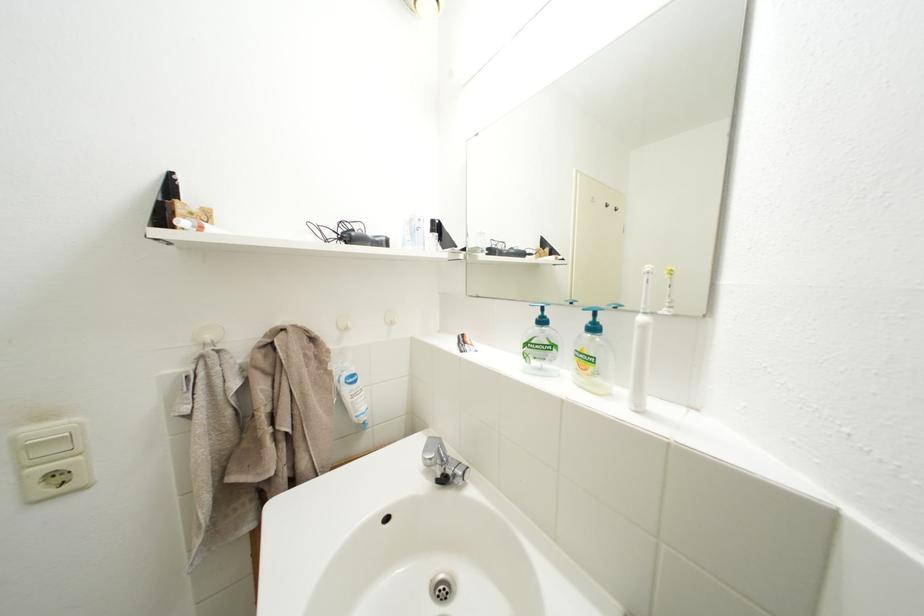
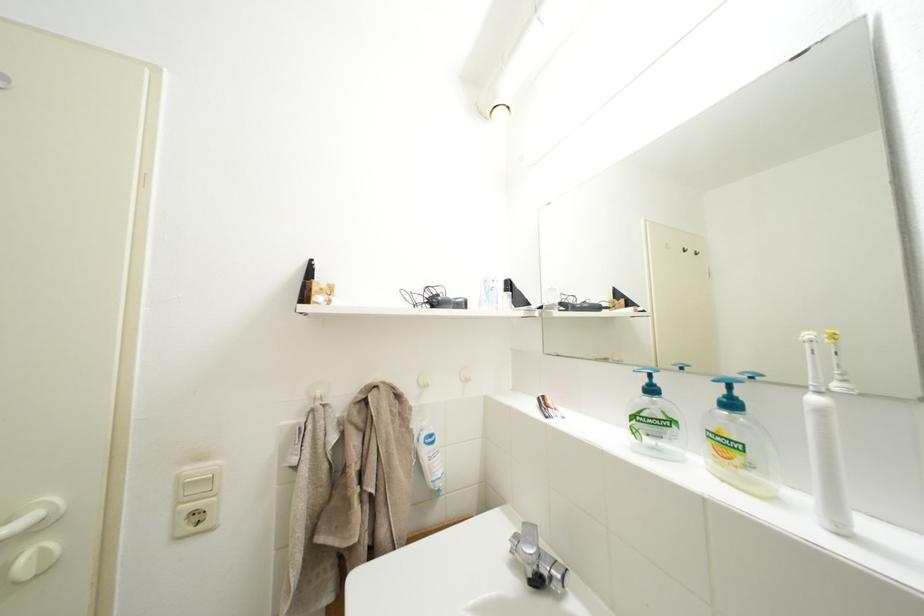
Question: The images are taken continuously from a first-person perspective. In which direction are you moving?

Choices:
 (A) Left
 (B) Right
 (C) Forward
 (D) Backward

Answer: (A)